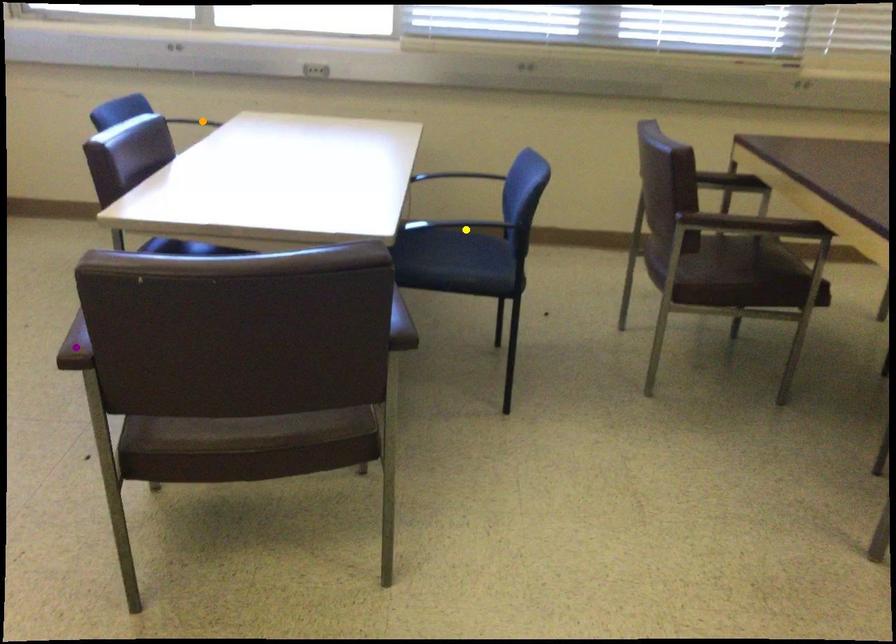
Order these from farthest to nearest:
purple point, orange point, yellow point

yellow point, orange point, purple point